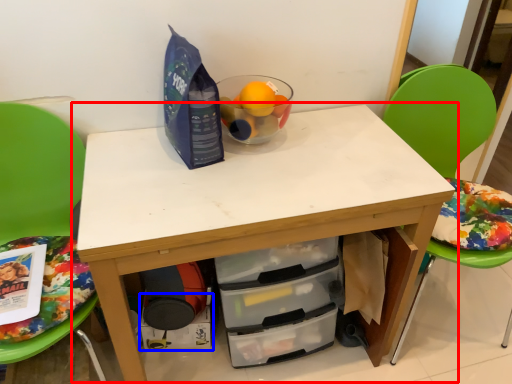
Question: Which point is closer to the camera, table (highlighted by a red box) or drawer (highlighted by a blue box)?

Choices:
 (A) table
 (B) drawer

Answer: (A)